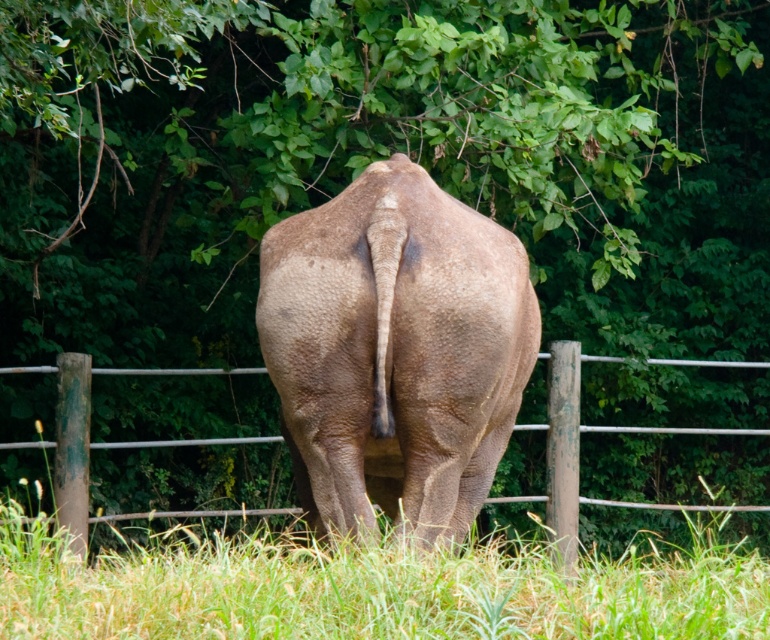
Question: Which point is farther from the camera taking this photo?

Choices:
 (A) (454, 268)
 (B) (563, 381)

Answer: (B)

Question: Observing the image, what is the correct spatial positioning of gray textured elephant at center in reference to brown wooden fence at center?

Choices:
 (A) below
 (B) above

Answer: (B)

Question: Considering the relative positions of gray textured elephant at center and brown wooden fence at center in the image provided, where is gray textured elephant at center located with respect to brown wooden fence at center?

Choices:
 (A) above
 (B) below

Answer: (A)

Question: Is gray textured elephant at center above brown wooden fence at center?

Choices:
 (A) no
 (B) yes

Answer: (B)

Question: Which point is farther to the camera?

Choices:
 (A) brown wooden fence at center
 (B) gray textured elephant at center

Answer: (A)

Question: Which of the following is the farthest from the observer?

Choices:
 (A) gray textured elephant at center
 (B) brown wooden fence at center

Answer: (B)